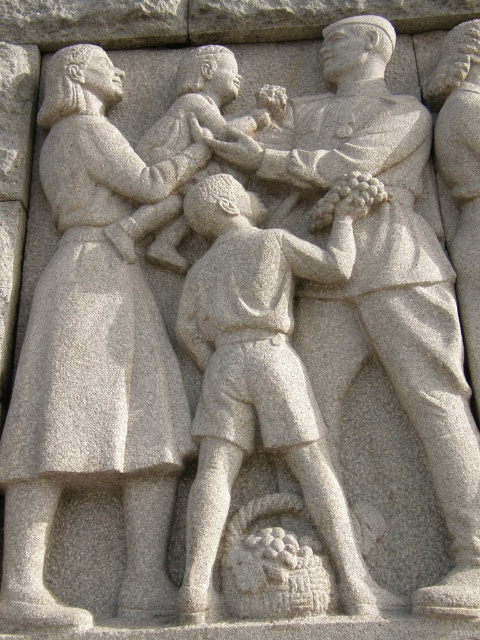
Based on the scene described, which figure is taller between the granite statue of woman holding child at left and the granite textured boy at center?

The granite statue of woman holding child at left is taller than the granite textured boy at center according to the description.

You are an art conservator examining the stone relief sculpture. You need to determine the spatial relationship between the granite statue of woman holding child at left and the granite textured boy at center. Which one is positioned further back in the sculpture?

The granite textured boy at center is behind the granite statue of woman holding child at left, so the boy is positioned further back in the sculpture.